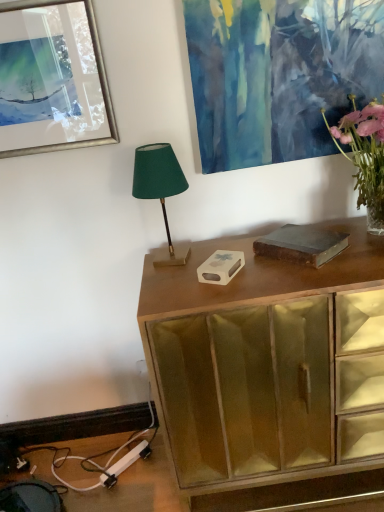
Question: From a real-world perspective, is pink glass vase at upper right above or below green fabric lampshade at center?

Choices:
 (A) below
 (B) above

Answer: (B)

Question: From their relative heights in the image, would you say pink glass vase at upper right is taller or shorter than green fabric lampshade at center?

Choices:
 (A) tall
 (B) short

Answer: (A)

Question: Which object is the farthest from the metallic silver picture frame at upper left?

Choices:
 (A) pink glass vase at upper right
 (B) green fabric lampshade at center
 (C) wooden cabinet at center

Answer: (A)

Question: Considering the real-world distances, which object is farthest from the pink glass vase at upper right?

Choices:
 (A) green fabric lampshade at center
 (B) wooden cabinet at center
 (C) metallic silver picture frame at upper left

Answer: (C)